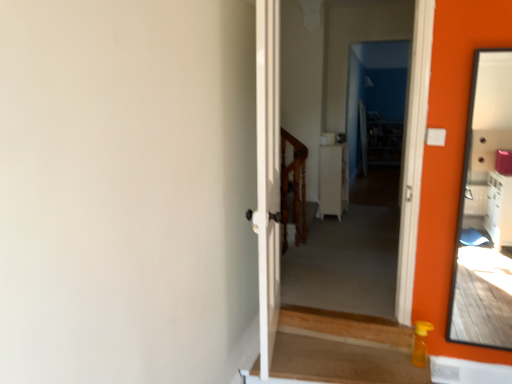
Question: Can you confirm if wooden at center is taller than matte orange mirror at right?

Choices:
 (A) no
 (B) yes

Answer: (A)

Question: Does wooden at center appear on the left side of matte orange mirror at right?

Choices:
 (A) yes
 (B) no

Answer: (A)

Question: Is wooden at center bigger than matte orange mirror at right?

Choices:
 (A) no
 (B) yes

Answer: (A)

Question: Is wooden at center wider than matte orange mirror at right?

Choices:
 (A) no
 (B) yes

Answer: (B)

Question: Can you confirm if wooden at center is thinner than matte orange mirror at right?

Choices:
 (A) yes
 (B) no

Answer: (B)

Question: Could you tell me if wooden at center is turned towards matte orange mirror at right?

Choices:
 (A) no
 (B) yes

Answer: (A)

Question: Can white glossy cabinet at center be found inside wooden at center?

Choices:
 (A) no
 (B) yes

Answer: (A)

Question: Are wooden at center and white glossy cabinet at center located far from each other?

Choices:
 (A) no
 (B) yes

Answer: (A)

Question: Considering the relative sizes of wooden at center and white glossy cabinet at center in the image provided, is wooden at center shorter than white glossy cabinet at center?

Choices:
 (A) yes
 (B) no

Answer: (B)

Question: Does wooden at center lie behind white glossy cabinet at center?

Choices:
 (A) yes
 (B) no

Answer: (B)

Question: Is wooden at center facing away from white glossy cabinet at center?

Choices:
 (A) no
 (B) yes

Answer: (B)

Question: From the image's perspective, would you say wooden at center is positioned over white glossy cabinet at center?

Choices:
 (A) yes
 (B) no

Answer: (B)

Question: From the image's perspective, is matte orange mirror at right below wooden at center?

Choices:
 (A) no
 (B) yes

Answer: (A)